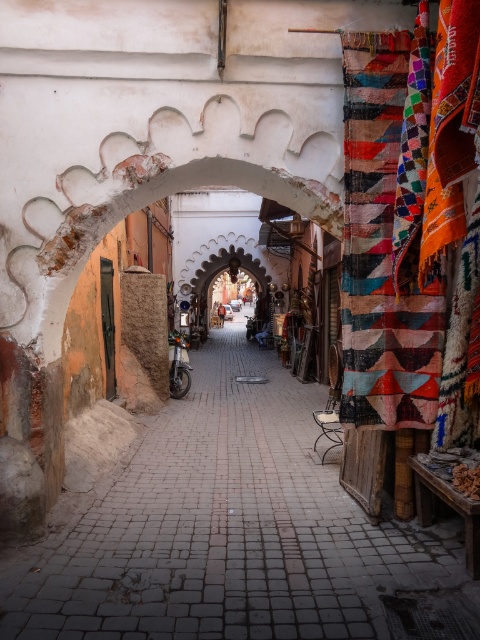
Question: Can you confirm if multicolored woven rug at right is wider than silver metallic motorcycle at center?

Choices:
 (A) yes
 (B) no

Answer: (A)

Question: Which object is closer to the camera taking this photo?

Choices:
 (A) silver metallic motorcycle at center
 (B) brick paved alley at center
 (C) multicolored woven rug at right

Answer: (B)

Question: Is brick paved alley at center to the left of multicolored woven rug at right from the viewer's perspective?

Choices:
 (A) no
 (B) yes

Answer: (B)

Question: Among these points, which one is nearest to the camera?

Choices:
 (A) (408, 324)
 (B) (317, 467)
 (C) (184, 352)

Answer: (A)

Question: Estimate the real-world distances between objects in this image. Which object is farther from the silver metallic motorcycle at center?

Choices:
 (A) brick paved alley at center
 (B) multicolored woven rug at right

Answer: (B)

Question: Does brick paved alley at center appear over multicolored woven rug at right?

Choices:
 (A) yes
 (B) no

Answer: (B)